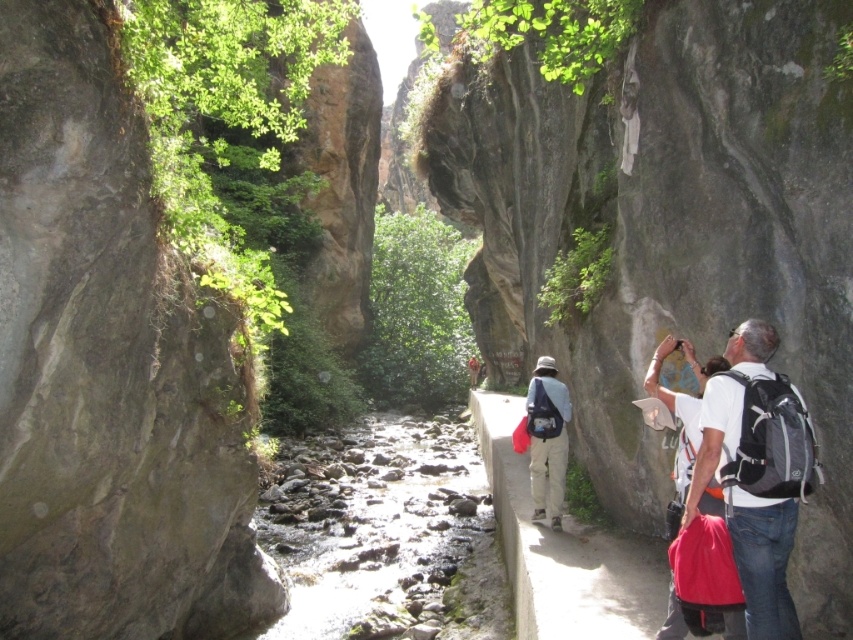
Can you confirm if white fabric backpack at right is positioned below khaki fabric pants at center?

Actually, white fabric backpack at right is above khaki fabric pants at center.

Which is below, white fabric backpack at right or khaki fabric pants at center?

khaki fabric pants at center is lower down.

What are the coordinates of `white fabric backpack at right` in the screenshot? It's located at (755, 472).

Find the location of a particular element. white fabric backpack at right is located at coordinates (755, 472).